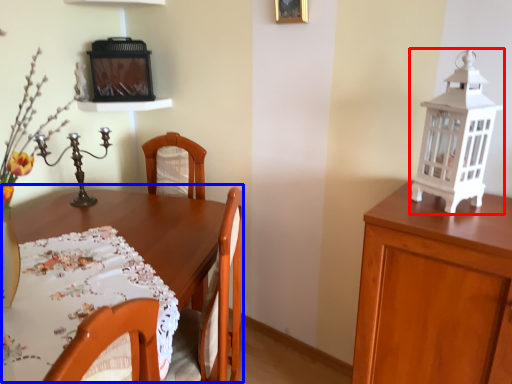
Question: Among these objects, which one is nearest to the camera, lantern (highlighted by a red box) or table (highlighted by a blue box)?

Choices:
 (A) lantern
 (B) table

Answer: (B)